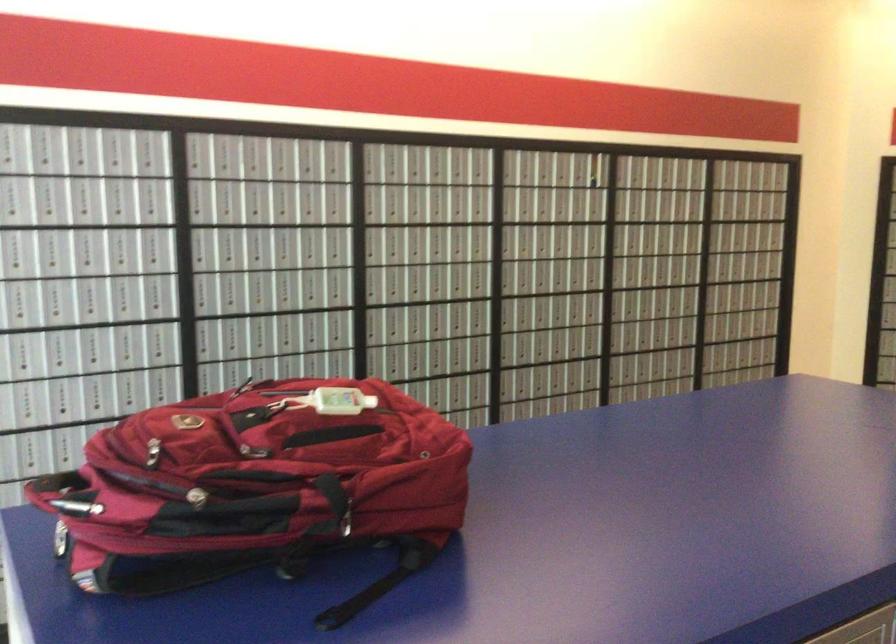
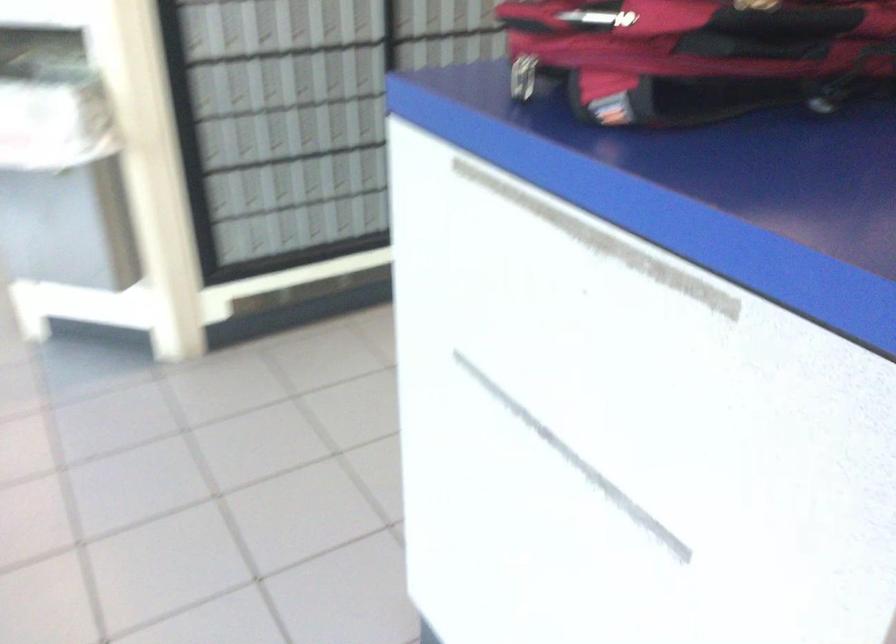
Where in the second image is the point corresponding to point (164, 538) from the first image?

(696, 55)